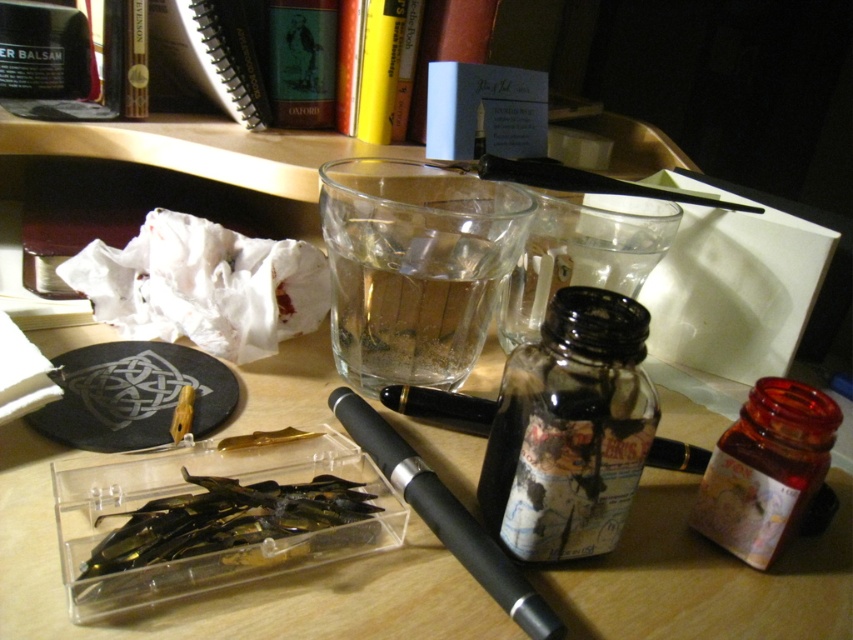
Question: Among these points, which one is nearest to the camera?

Choices:
 (A) (410, 404)
 (B) (492, 552)
 (C) (263, 508)
 (D) (590, 500)

Answer: (B)

Question: Can you confirm if transparent glass bottle at center is wider than transparent plastic container with pens at center?

Choices:
 (A) yes
 (B) no

Answer: (B)

Question: Considering the relative positions of translucent amber jar at right and black rubberized pen at center in the image provided, where is translucent amber jar at right located with respect to black rubberized pen at center?

Choices:
 (A) below
 (B) above

Answer: (B)

Question: Among these points, which one is farthest from the camera?

Choices:
 (A) (654, 454)
 (B) (537, 355)
 (C) (413, 508)
 (D) (165, 502)

Answer: (A)

Question: Which point appears closest to the camera in this image?

Choices:
 (A) (676, 451)
 (B) (822, 474)

Answer: (B)

Question: Is transparent glass bottle at center to the right of black glossy pen at center from the viewer's perspective?

Choices:
 (A) no
 (B) yes

Answer: (A)